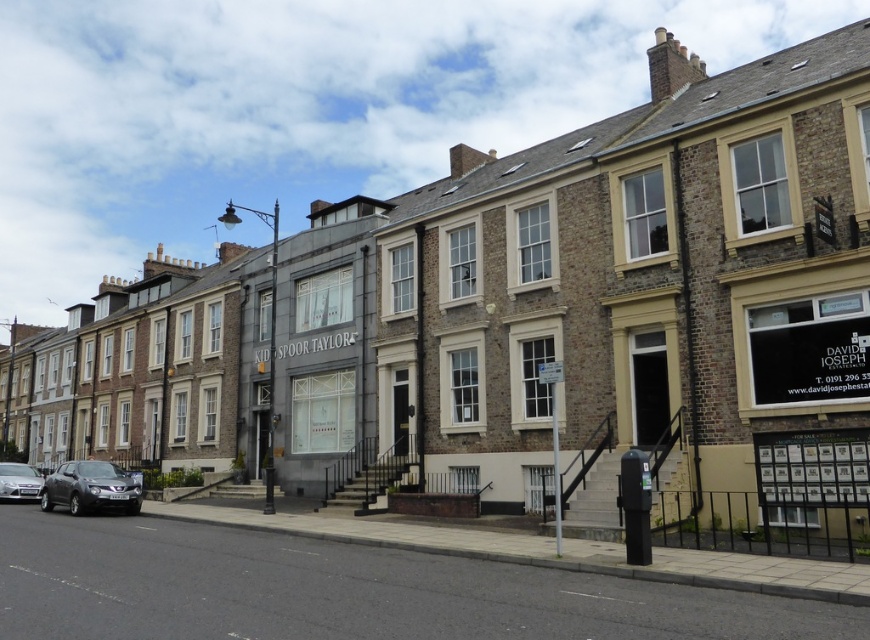
Does matte black suv at lower left lie in front of silver metallic car at lower left?

Yes, it is in front of silver metallic car at lower left.

Measure the distance between point (x=91, y=496) and camera.

They are 33.73 meters apart.

Locate an element on the screen. The height and width of the screenshot is (640, 870). matte black suv at lower left is located at coordinates (90, 486).

Find the location of `matte black suv at lower left`. matte black suv at lower left is located at coordinates (90, 486).